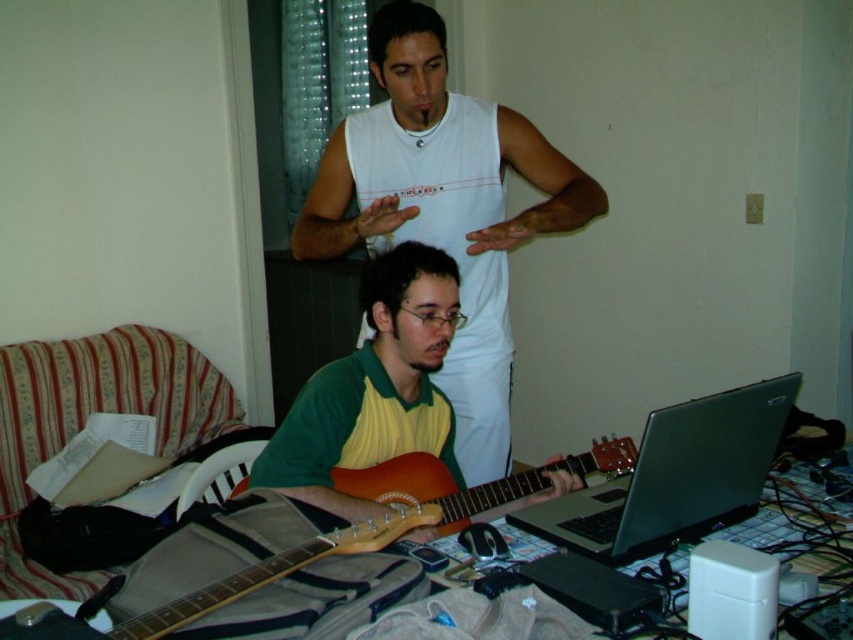
You are a photographer trying to capture a clear shot of the wooden acoustic guitar at center and the white sleeveless shirt at upper center. Since the guitar is partially hidden, which object should you adjust to get a better view of the other?

The wooden acoustic guitar at center is behind the white sleeveless shirt at upper center. To get a better view of the guitar, you should move the white sleeveless shirt at upper center out of the way.

Looking at this image, you are a photographer trying to capture a clear shot of the white sleeveless shirt at upper center and the wooden acoustic guitar at center. Which object should you zoom in on to ensure both are in focus without moving the camera?

The white sleeveless shirt at upper center is larger in size than the wooden acoustic guitar at center, so you should zoom in on the smaller wooden acoustic guitar at center to ensure both are in focus without moving the camera.